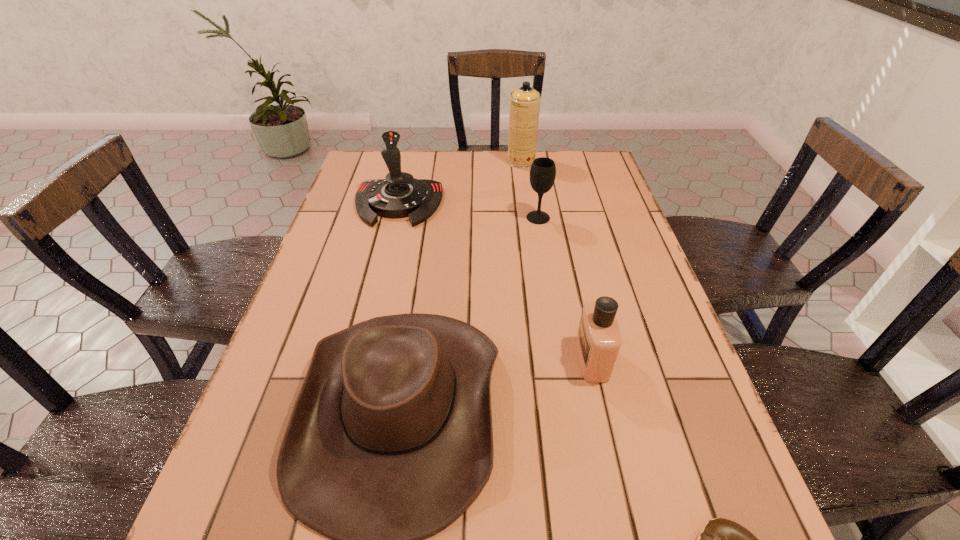
Identify the location of free location that satisfies the following two spatial constraints: 1. on the handle side of the joystick; 2. on the left side of the wineglass. (395, 218).